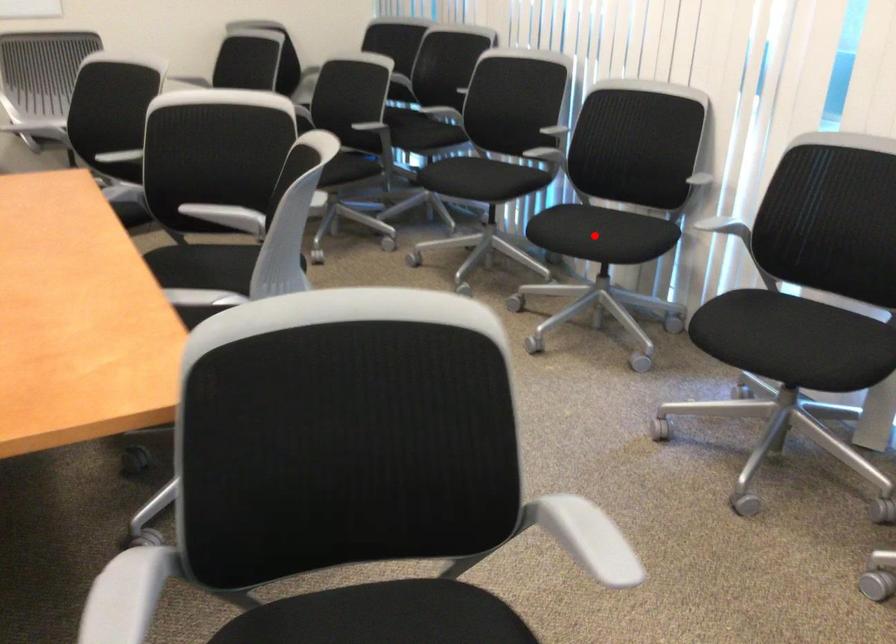
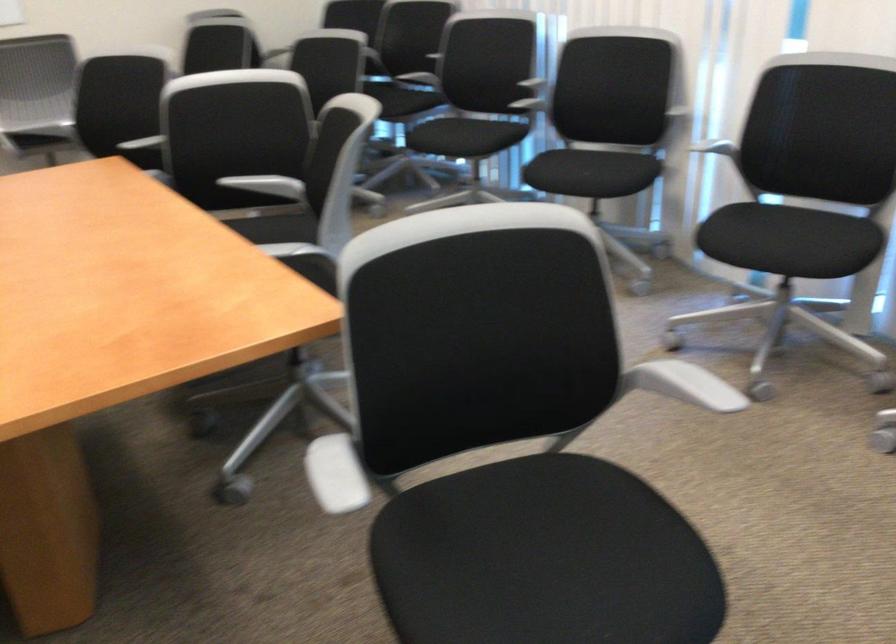
Locate, in the second image, the point that corresponds to the highlighted location in the first image.

(587, 174)